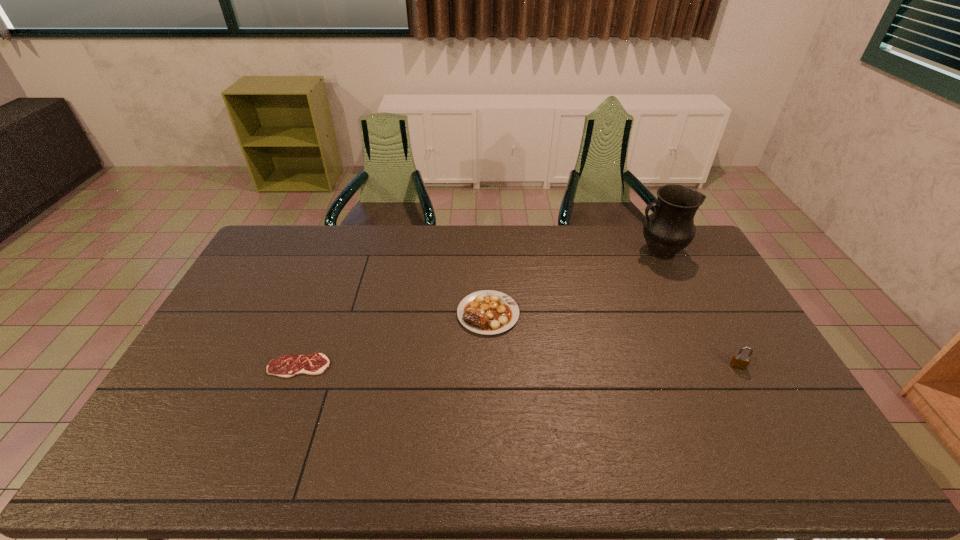
Locate an element on the screen. vacant space at the right edge of the desktop is located at coordinates (681, 264).

What are the coordinates of `vacant area that lies between the farther steak and the tallest object` in the screenshot? It's located at (574, 283).

This screenshot has width=960, height=540. Identify the location of vacant space that's between the second tallest object and the shorter steak. (518, 366).

Where is `vacant space that is in between the farthest object and the taller steak`? The height and width of the screenshot is (540, 960). vacant space that is in between the farthest object and the taller steak is located at coordinates (574, 283).

Where is `vacant region between the tallest object and the third tallest object`? The image size is (960, 540). vacant region between the tallest object and the third tallest object is located at coordinates (574, 283).

Find the location of a particular element. The width and height of the screenshot is (960, 540). free spot between the nearer steak and the third nearest object is located at coordinates (394, 340).

Image resolution: width=960 pixels, height=540 pixels. I want to click on free spot between the farthest object and the third nearest object, so click(574, 283).

Where is `empty space between the second tallest object and the farthest object`? The height and width of the screenshot is (540, 960). empty space between the second tallest object and the farthest object is located at coordinates (699, 309).

Identify the location of unoccupied position between the tallest object and the second tallest object. (699, 309).

You are a GUI agent. You are given a task and a screenshot of the screen. Output one action in this format:
    pyautogui.click(x=<x>, y=<y>)
    Task: Click on the free spot between the farthest object and the second shortest object
    
    Given the screenshot: What is the action you would take?
    coord(574,283)